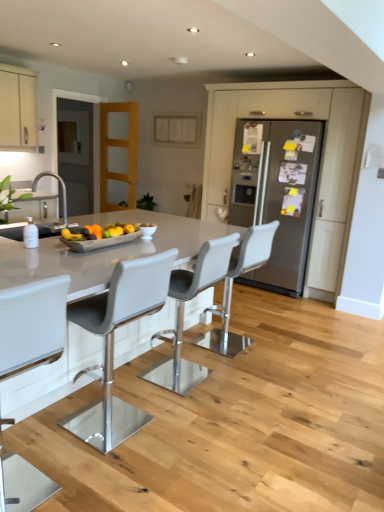
In order to click on empty space that is in between white leather bar stool at center, arranged as the 4th chair when viewed from the front, and white leather bar stool at center, acting as the 3th chair starting from the front in this screenshot , I will do `click(213, 364)`.